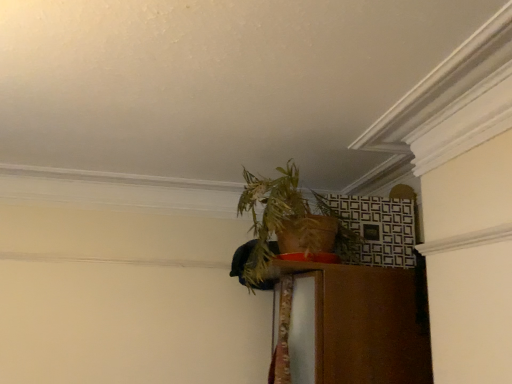
Question: Should I look upward or downward to see green leafy plant at upper center?

Choices:
 (A) up
 (B) down

Answer: (B)